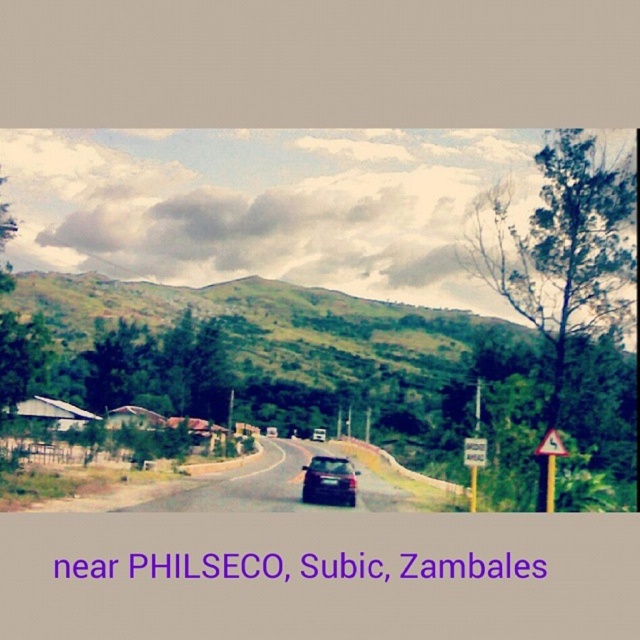
Is satin black car at center bigger than yellow plastic triangle at right?

Correct, satin black car at center is larger in size than yellow plastic triangle at right.

Who is higher up, satin black car at center or yellow plastic triangle at right?

Positioned higher is yellow plastic triangle at right.

Is point (353, 488) farther from camera compared to point (554, 474)?

Yes, point (353, 488) is behind point (554, 474).

Locate an element on the screen. This screenshot has width=640, height=640. satin black car at center is located at coordinates (328, 481).